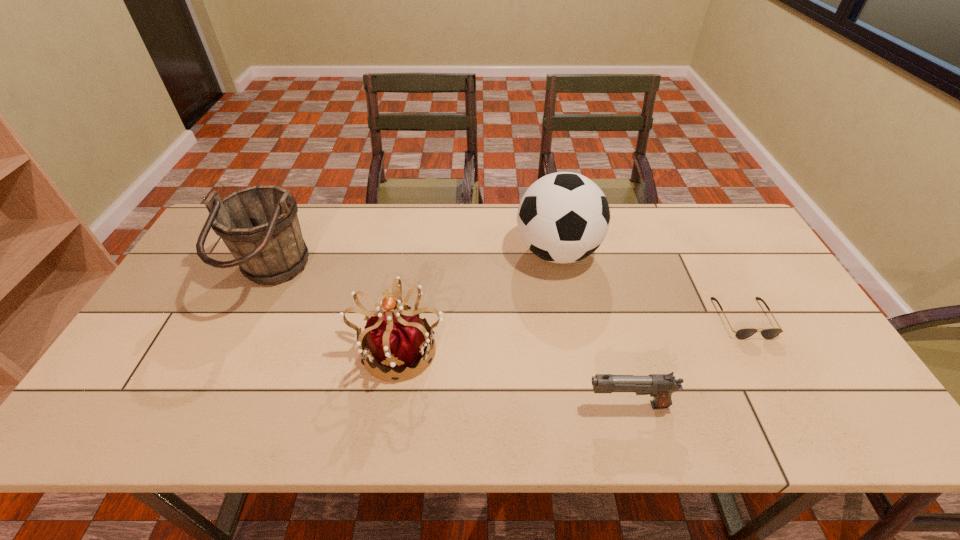
At what (x,y) coordinates should I click in order to perform the action: click on free space between the shortest object and the nearest object. Please return your answer as a coordinate pair (x, y). The height and width of the screenshot is (540, 960). Looking at the image, I should click on (685, 361).

Locate an element on the screen. The width and height of the screenshot is (960, 540). vacant region between the sunglasses and the bucket is located at coordinates (508, 298).

At what (x,y) coordinates should I click in order to perform the action: click on empty space that is in between the second shortest object and the soccer ball. Please return your answer as a coordinate pair (x, y). The width and height of the screenshot is (960, 540). Looking at the image, I should click on (592, 328).

Locate an element on the screen. The width and height of the screenshot is (960, 540). unoccupied area between the rightmost object and the soccer ball is located at coordinates (651, 285).

I want to click on empty space between the gun and the soccer ball, so click(x=592, y=328).

Identify the location of object that is the third closest to the soccer ball. The width and height of the screenshot is (960, 540). (660, 386).

Locate an element on the screen. the third closest object to the rightmost object is located at coordinates (398, 340).